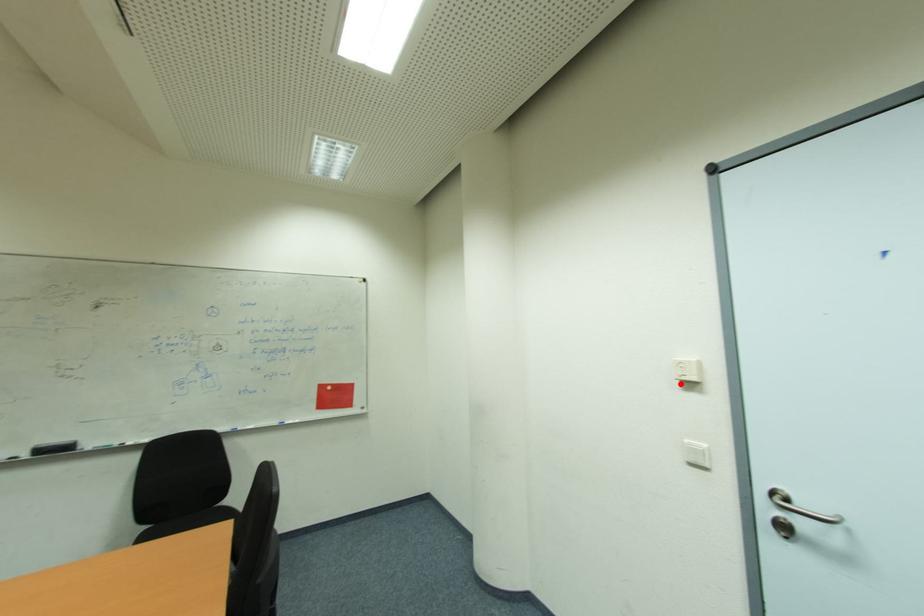
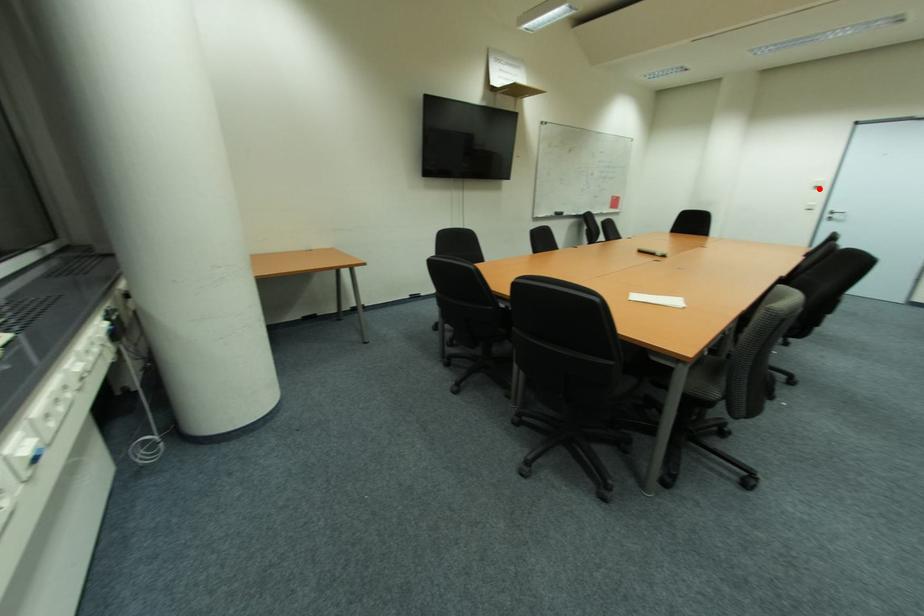
I am providing you with two images of the same scene from different viewpoints. A red point is marked on the first image and another point is marked on the second image. Is the red point in image1 aligned with the point shown in image2?

Yes